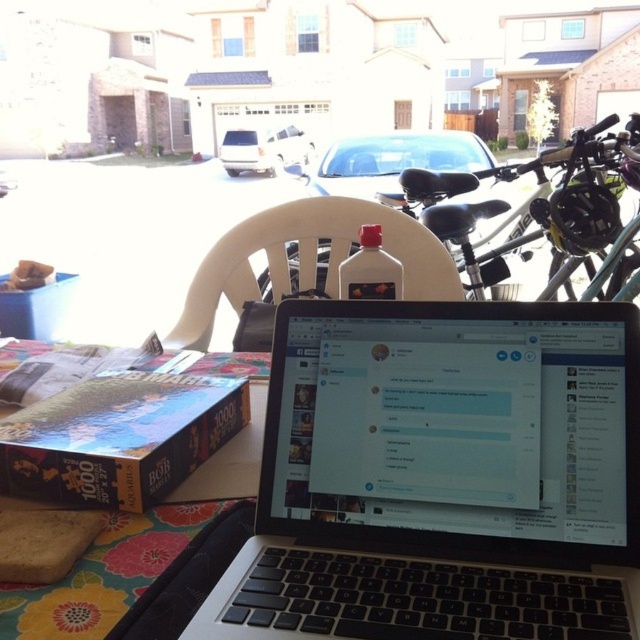
How much distance is there between silver/black laptop at center and metallic silver bicycle at right?

They are 1.63 meters apart.

Who is higher up, silver/black laptop at center or metallic silver bicycle at right?

metallic silver bicycle at right is higher up.

Find the location of `silver/black laptop at center`. silver/black laptop at center is located at coordinates [442, 476].

The height and width of the screenshot is (640, 640). I want to click on silver/black laptop at center, so click(442, 476).